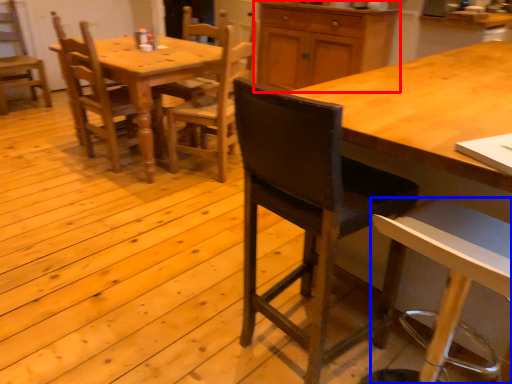
Question: Which object appears farthest to the camera in this image, cabinetry (highlighted by a red box) or chair (highlighted by a blue box)?

Choices:
 (A) cabinetry
 (B) chair

Answer: (A)